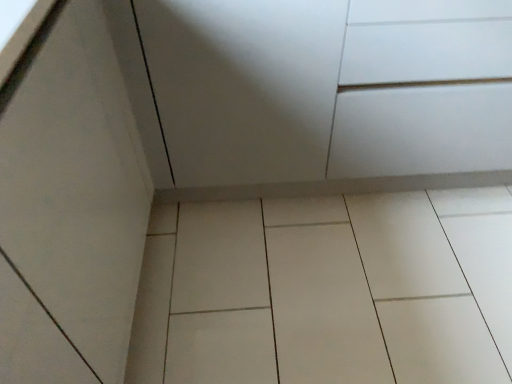
The height and width of the screenshot is (384, 512). What do you see at coordinates (328, 290) in the screenshot? I see `white matte tile at center` at bounding box center [328, 290].

In order to face white matte tile at center, should I rotate leftwards or rightwards?

Turn right approximately 13.560 degrees to face it.

Image resolution: width=512 pixels, height=384 pixels. I want to click on white matte tile at center, so tap(328, 290).

Find the location of a particular element. Image resolution: width=512 pixels, height=384 pixels. white matte tile at center is located at coordinates (328, 290).